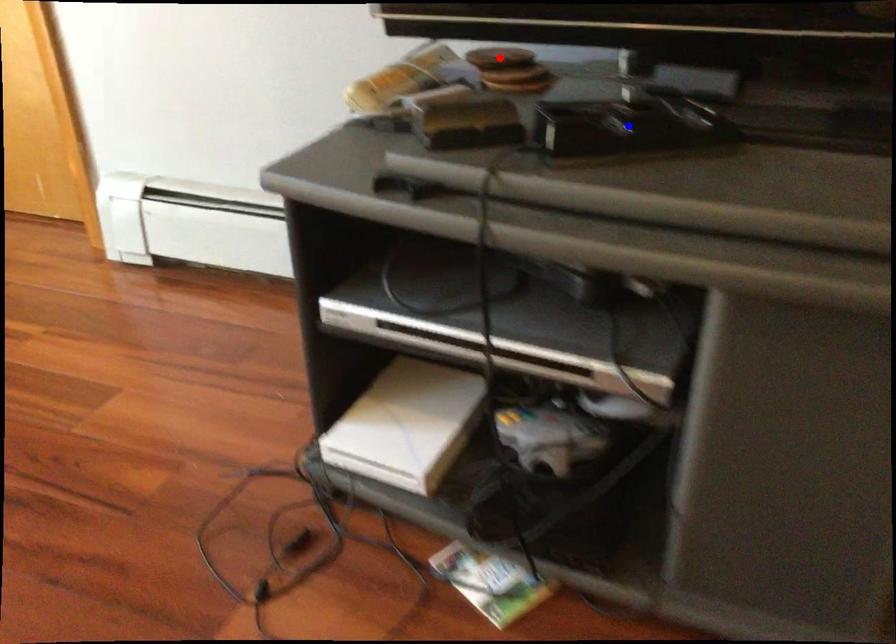
Question: In the image, two points are highlighted. Which point is nearer to the camera? Reply with the corresponding letter.

Choices:
 (A) blue point
 (B) red point

Answer: (A)